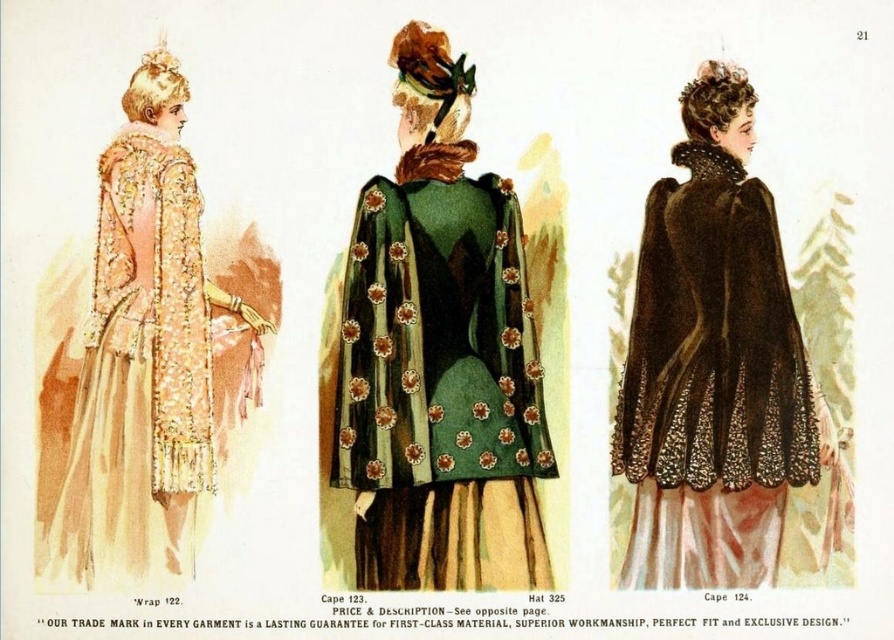
This screenshot has width=894, height=640. I want to click on green velvet cape at center, so click(x=440, y=384).

Is the position of green velvet cape at center more distant than that of matte gold cape at left?

That is False.

Describe the element at coordinates (440, 384) in the screenshot. The width and height of the screenshot is (894, 640). I see `green velvet cape at center` at that location.

You are a GUI agent. You are given a task and a screenshot of the screen. Output one action in this format:
    pyautogui.click(x=<x>, y=<y>)
    Task: Click on the green velvet cape at center
    
    Given the screenshot: What is the action you would take?
    pyautogui.click(x=440, y=384)

Does velvet cape at center have a larger size compared to matte gold cape at left?

Yes.

Who is lower down, velvet cape at center or matte gold cape at left?

velvet cape at center is lower down.

The image size is (894, 640). I want to click on velvet cape at center, so click(718, 371).

This screenshot has height=640, width=894. I want to click on velvet cape at center, so click(x=718, y=371).

How far apart are green velvet cape at center and velvet cape at center?

20.38 inches

This screenshot has width=894, height=640. What do you see at coordinates (440, 384) in the screenshot? I see `green velvet cape at center` at bounding box center [440, 384].

Find the location of a particular element. Image resolution: width=894 pixels, height=640 pixels. green velvet cape at center is located at coordinates (440, 384).